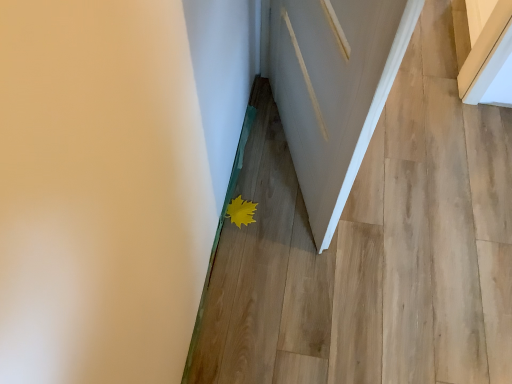
Identify the location of white wood door at center. (334, 89).

Describe the element at coordinates (334, 89) in the screenshot. I see `white wood door at center` at that location.

What is the approximate height of matte white door at lower center?

The height of matte white door at lower center is 2.92 centimeters.

Identify the location of white wood door at center. The height and width of the screenshot is (384, 512). (334, 89).

Could matte white door at lower center be considered to be inside yellow matte leaf at lower center?

No, matte white door at lower center is located outside of yellow matte leaf at lower center.

This screenshot has width=512, height=384. I want to click on flower that is above the matte white door at lower center (from a real-world perspective), so click(241, 211).

Does yellow matte leaf at lower center have a lesser height compared to matte white door at lower center?

Yes, yellow matte leaf at lower center is shorter than matte white door at lower center.

Is yellow matte leaf at lower center further to the viewer compared to matte white door at lower center?

Yes, the depth of yellow matte leaf at lower center is greater than that of matte white door at lower center.

In the scene shown: Is matte white door at lower center surrounded by white wood door at center?

No, white wood door at center does not contain matte white door at lower center.

Is white wood door at center to the left of matte white door at lower center from the viewer's perspective?

Correct, you'll find white wood door at center to the left of matte white door at lower center.

In the scene shown: Can you confirm if white wood door at center is thinner than matte white door at lower center?

Correct, the width of white wood door at center is less than that of matte white door at lower center.

Who is smaller, white wood door at center or matte white door at lower center?

With smaller size is matte white door at lower center.

Can you confirm if matte white door at lower center is shorter than white wood door at center?

Indeed, matte white door at lower center has a lesser height compared to white wood door at center.

From the image's perspective, between matte white door at lower center and white wood door at center, which one is located above?

From the image's view, white wood door at center is above.

From a real-world perspective, between matte white door at lower center and white wood door at center, who is vertically lower?

matte white door at lower center, from a real-world perspective.

Looking at this image, is matte white door at lower center bigger or smaller than white wood door at center?

In the image, matte white door at lower center appears to be smaller than white wood door at center.

Considering the points (247, 224) and (328, 23), which point is in front, point (247, 224) or point (328, 23)?

The point (328, 23) is closer.

Is yellow matte leaf at lower center positioned beyond the bounds of white wood door at center?

yellow matte leaf at lower center is positioned outside white wood door at center.

The image size is (512, 384). Find the location of `door in front of the yellow matte leaf at lower center`. door in front of the yellow matte leaf at lower center is located at coordinates (334, 89).

From a real-world perspective, who is located lower, yellow matte leaf at lower center or white wood door at center?

In real-world perspective, yellow matte leaf at lower center is lower.

Identify the location of flower on the left of matte white door at lower center. pyautogui.click(x=241, y=211).

From the image's perspective, is matte white door at lower center on yellow matte leaf at lower center?

Yes, from the image's perspective, matte white door at lower center is above yellow matte leaf at lower center.

Could you tell me if matte white door at lower center is facing yellow matte leaf at lower center?

No, matte white door at lower center is not turned towards yellow matte leaf at lower center.

Relative to yellow matte leaf at lower center, is matte white door at lower center in front or behind?

matte white door at lower center is positioned closer to the viewer than yellow matte leaf at lower center.

Which is correct: white wood door at center is inside yellow matte leaf at lower center, or outside of it?

The correct answer is: outside.

Considering the positions of point (330, 98) and point (239, 202), is point (330, 98) closer or farther from the camera than point (239, 202)?

Point (330, 98) is positioned closer to the camera compared to point (239, 202).

Considering the positions of objects white wood door at center and yellow matte leaf at lower center in the image provided, who is more to the left, white wood door at center or yellow matte leaf at lower center?

yellow matte leaf at lower center.

Image resolution: width=512 pixels, height=384 pixels. What are the coordinates of `flower below the white wood door at center (from a real-world perspective)` in the screenshot? It's located at (241, 211).

At what (x,y) coordinates should I click in order to perform the action: click on flower above the matte white door at lower center (from a real-world perspective). Please return your answer as a coordinate pair (x, y). Looking at the image, I should click on (241, 211).

Where is `door that is on the left side of matte white door at lower center`? The image size is (512, 384). door that is on the left side of matte white door at lower center is located at coordinates (334, 89).

From the image, which object appears to be farther from white wood door at center, matte white door at lower center or yellow matte leaf at lower center?

yellow matte leaf at lower center is positioned further to the anchor white wood door at center.

Which object lies further to the anchor point matte white door at lower center, yellow matte leaf at lower center or white wood door at center?

Among the two, yellow matte leaf at lower center is located further to matte white door at lower center.

When comparing their distances from white wood door at center, does yellow matte leaf at lower center or matte white door at lower center seem closer?

matte white door at lower center is closer to white wood door at center.

Based on the photo, considering their positions, is white wood door at center positioned further to matte white door at lower center than yellow matte leaf at lower center?

Based on the image, yellow matte leaf at lower center appears to be further to matte white door at lower center.

Estimate the real-world distances between objects in this image. Which object is closer to yellow matte leaf at lower center, matte white door at lower center or white wood door at center?

Among the two, matte white door at lower center is located nearer to yellow matte leaf at lower center.

Which object lies nearer to the anchor point yellow matte leaf at lower center, white wood door at center or matte white door at lower center?

matte white door at lower center is closer to yellow matte leaf at lower center.

You are a GUI agent. You are given a task and a screenshot of the screen. Output one action in this format:
    pyautogui.click(x=<x>, y=<y>)
    Task: Click on the stairwell between white wood door at center and yellow matte leaf at lower center in the front-back direction
    
    Given the screenshot: What is the action you would take?
    pyautogui.click(x=374, y=246)